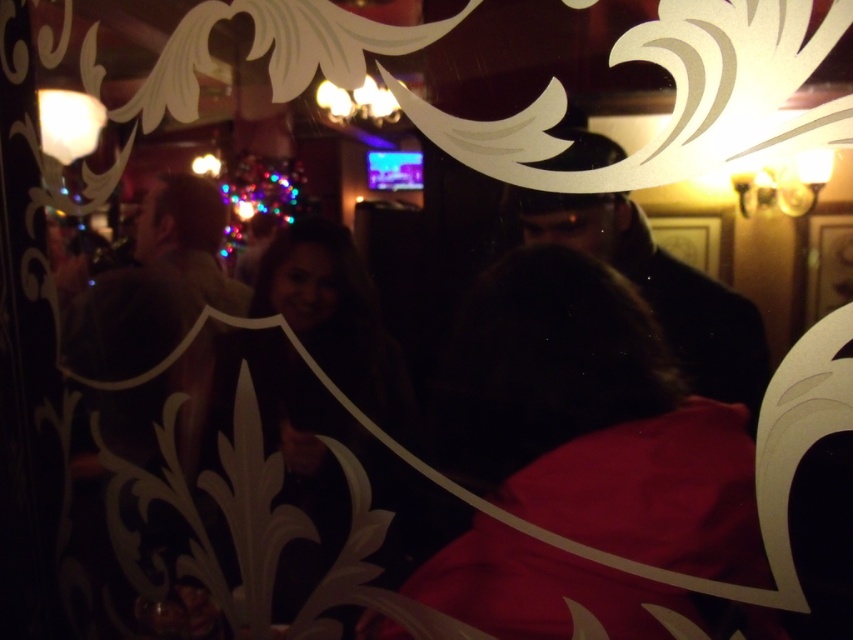
Question: Which is nearer to the dark brown leather jacket at center?

Choices:
 (A) dark brown hair at center
 (B) matte red coat at center

Answer: (B)

Question: Which of the following is the farthest from the observer?

Choices:
 (A) (299, 321)
 (B) (589, 260)

Answer: (A)

Question: Observing the image, what is the correct spatial positioning of matte red coat at center in reference to dark brown hair at center?

Choices:
 (A) right
 (B) left

Answer: (A)

Question: Does matte red coat at center lie behind dark brown leather jacket at center?

Choices:
 (A) yes
 (B) no

Answer: (A)

Question: Among these objects, which one is farthest from the camera?

Choices:
 (A) dark brown leather jacket at center
 (B) dark brown hair at center
 (C) matte red coat at center

Answer: (B)

Question: Does dark brown hair at center have a larger size compared to dark brown leather jacket at center?

Choices:
 (A) no
 (B) yes

Answer: (B)